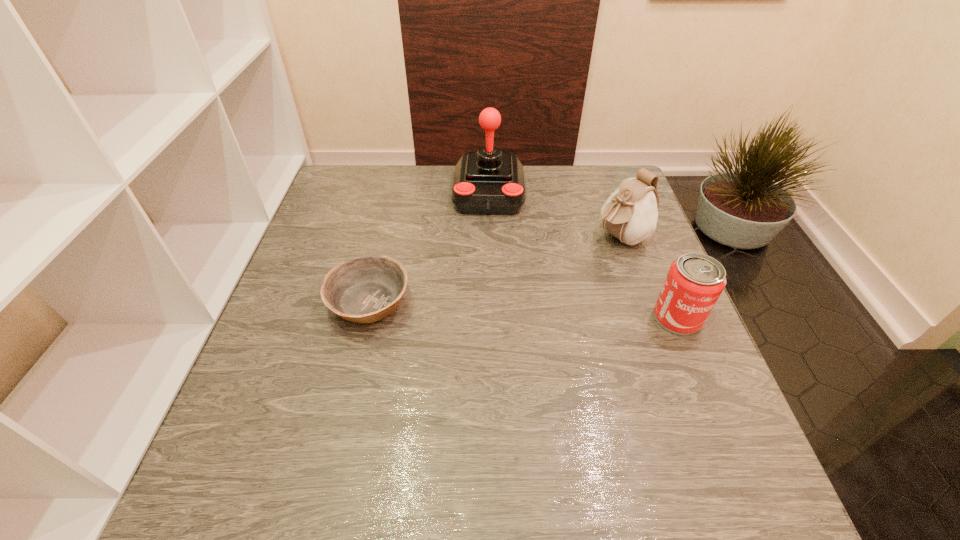
This screenshot has height=540, width=960. In order to click on the leftmost object in this screenshot , I will do `click(366, 289)`.

You are a GUI agent. You are given a task and a screenshot of the screen. Output one action in this format:
    pyautogui.click(x=<x>, y=<y>)
    Task: Click on the bowl
    The height and width of the screenshot is (540, 960).
    Given the screenshot: What is the action you would take?
    pyautogui.click(x=366, y=289)

In order to click on the third tallest object in this screenshot , I will do `click(695, 281)`.

Find the location of a particular element. pouch is located at coordinates point(630,214).

You are a GUI agent. You are given a task and a screenshot of the screen. Output one action in this format:
    pyautogui.click(x=<x>, y=<y>)
    Task: Click on the joystick
    This screenshot has height=540, width=960.
    Given the screenshot: What is the action you would take?
    pyautogui.click(x=486, y=182)

You are a GUI agent. You are given a task and a screenshot of the screen. Output one action in this format:
    pyautogui.click(x=<x>, y=<y>)
    Task: Click on the tallest object
    The width and height of the screenshot is (960, 540).
    Given the screenshot: What is the action you would take?
    pyautogui.click(x=486, y=182)

You are a GUI agent. You are given a task and a screenshot of the screen. Output one action in this format:
    pyautogui.click(x=<x>, y=<y>)
    Task: Click on the vacant area situated on the right of the bowl
    This screenshot has height=540, width=960.
    Given the screenshot: What is the action you would take?
    pyautogui.click(x=455, y=303)

This screenshot has width=960, height=540. What are the coordinates of `free space located on the left of the third tallest object` in the screenshot? It's located at (512, 318).

Find the location of `free space located 0.350m on the front-facing side of the third shortest object`. free space located 0.350m on the front-facing side of the third shortest object is located at coordinates (491, 312).

Locate an element on the screen. The height and width of the screenshot is (540, 960). vacant space situated on the front-facing side of the third shortest object is located at coordinates (567, 266).